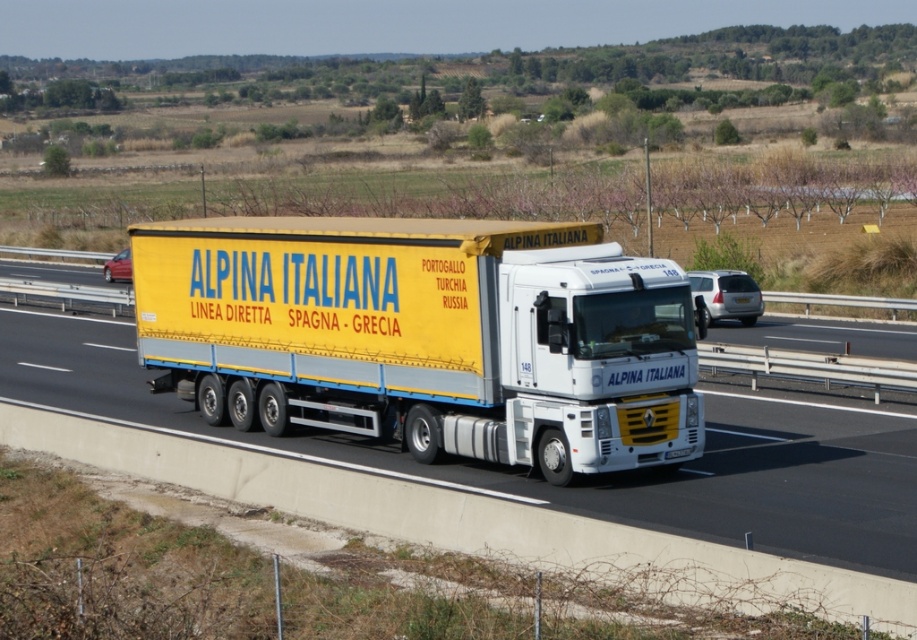
You are a delivery driver planning to pass under a bridge with a height restriction of 4 meters. Given that the yellow matte trailer truck at center is taller than the yellow matte truck at center, which one should you avoid driving under the bridge with to ensure safety?

You should avoid driving the yellow matte trailer truck at center under the bridge because it is taller than the yellow matte truck at center, making it more likely to exceed the 4 meter height restriction.

You are a delivery driver following the semi truck with the ALPINA ITALIANA branding on the highway. You notice two points marked on your GPS navigation. The first point is at coordinate point (x=661, y=442) and the second is at coordinate point (x=888, y=524). According to the scene description, which point is located behind the other?

Point (x=661, y=442) is behind point (x=888, y=524).